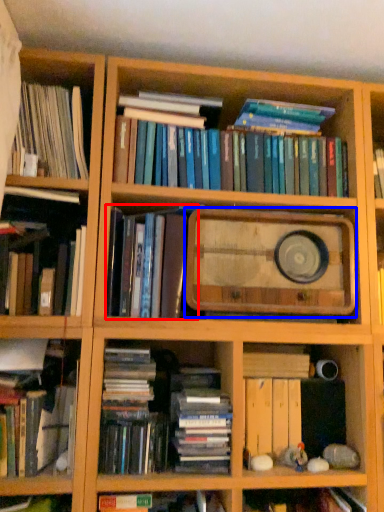
Question: Which object is further to the camera taking this photo, book (highlighted by a red box) or paperback book (highlighted by a blue box)?

Choices:
 (A) book
 (B) paperback book

Answer: (B)